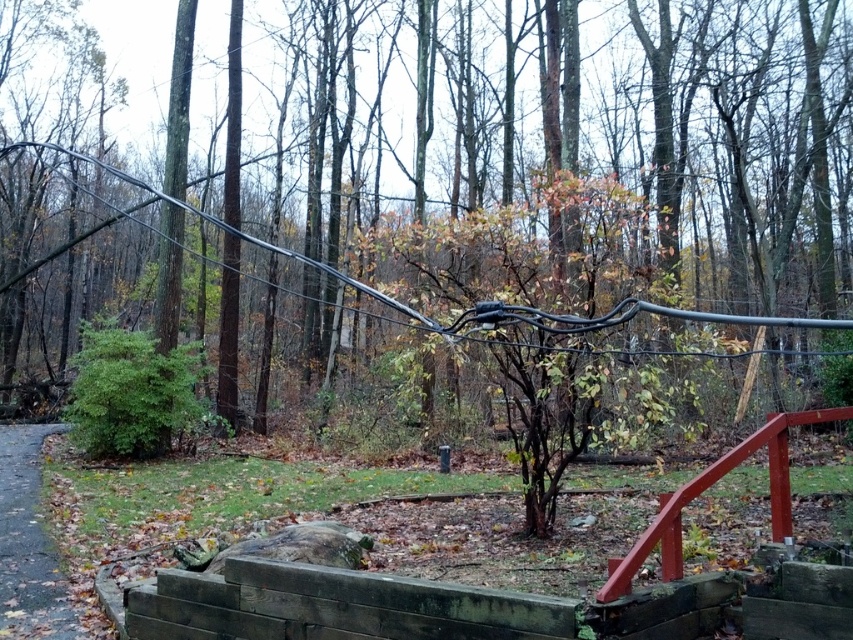
Which is in front, point (743, 182) or point (22, 509)?

Point (22, 509) is more forward.

Does point (22, 33) come farther from viewer compared to point (54, 426)?

That is True.

The image size is (853, 640). Describe the element at coordinates (524, 188) in the screenshot. I see `green matte tree at center` at that location.

In order to click on green matte tree at center in this screenshot , I will do `click(524, 188)`.

How much distance is there between gray asphalt path at lower left and smooth red wooden rail at lower right?

They are 3.60 meters apart.

Based on the photo, does gray asphalt path at lower left appear under smooth red wooden rail at lower right?

Indeed, gray asphalt path at lower left is positioned under smooth red wooden rail at lower right.

Identify the location of gray asphalt path at lower left. This screenshot has width=853, height=640. (28, 545).

Does green matte tree at center have a smaller size compared to smooth red wooden rail at lower right?

No.

Can you confirm if green matte tree at center is thinner than smooth red wooden rail at lower right?

Incorrect, green matte tree at center's width is not less than smooth red wooden rail at lower right's.

You are a GUI agent. You are given a task and a screenshot of the screen. Output one action in this format:
    pyautogui.click(x=<x>, y=<y>)
    Task: Click on the green matte tree at center
    The height and width of the screenshot is (640, 853).
    Given the screenshot: What is the action you would take?
    pyautogui.click(x=524, y=188)